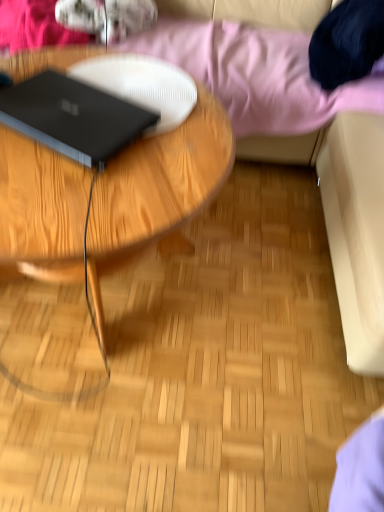
Identify the location of wooden coffee table at center. (126, 242).

What do you see at coordinates (258, 75) in the screenshot? I see `pink fabric at upper center` at bounding box center [258, 75].

Where is `black matte laptop at left`? black matte laptop at left is located at coordinates (73, 116).

Locate an element on the screen. wooden coffee table at center is located at coordinates (126, 242).

From a real-world perspective, between black matte laptop at left and pink fabric at upper center, who is vertically higher?

From a 3D spatial view, black matte laptop at left is above.

Is pink fabric at upper center at the back of black matte laptop at left?

Yes, black matte laptop at left is facing away from pink fabric at upper center.

Is black matte laptop at left at the left side of pink fabric at upper center?

Yes, black matte laptop at left is to the left of pink fabric at upper center.

From the image's perspective, between black matte laptop at left and pink fabric at upper center, which one is located above?

pink fabric at upper center, from the image's perspective.

Is pink fabric at upper center next to wooden coffee table at center and touching it?

No, pink fabric at upper center is not in contact with wooden coffee table at center.

Would you say pink fabric at upper center is outside wooden coffee table at center?

That's correct, pink fabric at upper center is outside of wooden coffee table at center.

Based on the photo, from the image's perspective, does pink fabric at upper center appear lower than wooden coffee table at center?

No, from the image's perspective, pink fabric at upper center is not beneath wooden coffee table at center.

In terms of height, does pink fabric at upper center look taller or shorter compared to black matte laptop at left?

Clearly, pink fabric at upper center is taller compared to black matte laptop at left.

Can you confirm if pink fabric at upper center is smaller than black matte laptop at left?

Actually, pink fabric at upper center might be larger than black matte laptop at left.

Between wooden coffee table at center and black matte laptop at left, which one appears on the right side from the viewer's perspective?

Positioned to the right is black matte laptop at left.

From the image's perspective, would you say wooden coffee table at center is shown under black matte laptop at left?

Correct, wooden coffee table at center appears lower than black matte laptop at left in the image.

Does wooden coffee table at center have a greater height compared to black matte laptop at left?

Indeed, wooden coffee table at center has a greater height compared to black matte laptop at left.

Between wooden coffee table at center and pink fabric at upper center, which one has smaller width?

With smaller width is wooden coffee table at center.

Is wooden coffee table at center smaller than pink fabric at upper center?

Correct, wooden coffee table at center occupies less space than pink fabric at upper center.

Between point (39, 161) and point (54, 40), which one is positioned in front?

Point (39, 161)

Where is `bedding that is above the wooden coffee table at center (from a real-world perspective)`? This screenshot has height=512, width=384. bedding that is above the wooden coffee table at center (from a real-world perspective) is located at coordinates (258, 75).

Can we say black matte laptop at left lies outside wooden coffee table at center?

No, black matte laptop at left is not outside of wooden coffee table at center.

Are black matte laptop at left and wooden coffee table at center far apart?

black matte laptop at left is actually quite close to wooden coffee table at center.

Could you tell me if black matte laptop at left is turned towards wooden coffee table at center?

No.

Considering the sizes of black matte laptop at left and wooden coffee table at center in the image, is black matte laptop at left bigger or smaller than wooden coffee table at center?

In the image, black matte laptop at left appears to be smaller than wooden coffee table at center.

At what (x,y) coordinates should I click in order to perform the action: click on bedding beneath the black matte laptop at left (from a real-world perspective). Please return your answer as a coordinate pair (x, y). Looking at the image, I should click on (258, 75).

The image size is (384, 512). I want to click on coffee table in front of the pink fabric at upper center, so click(126, 242).

Considering their positions, is wooden coffee table at center positioned further to pink fabric at upper center than black matte laptop at left?

wooden coffee table at center.

Consider the image. From the image, which object appears to be nearer to wooden coffee table at center, black matte laptop at left or pink fabric at upper center?

Among the two, black matte laptop at left is located nearer to wooden coffee table at center.

Based on their spatial positions, is pink fabric at upper center or black matte laptop at left further from wooden coffee table at center?

Among the two, pink fabric at upper center is located further to wooden coffee table at center.

Looking at the image, which one is located closer to pink fabric at upper center, black matte laptop at left or wooden coffee table at center?

black matte laptop at left lies closer to pink fabric at upper center than the other object.

Based on their spatial positions, is wooden coffee table at center or pink fabric at upper center closer to black matte laptop at left?

wooden coffee table at center is positioned closer to the anchor black matte laptop at left.

Based on their spatial positions, is pink fabric at upper center or wooden coffee table at center further from black matte laptop at left?

Among the two, pink fabric at upper center is located further to black matte laptop at left.

Where is `laptop between pink fabric at upper center and wooden coffee table at center in the vertical direction`? The width and height of the screenshot is (384, 512). laptop between pink fabric at upper center and wooden coffee table at center in the vertical direction is located at coordinates (73, 116).